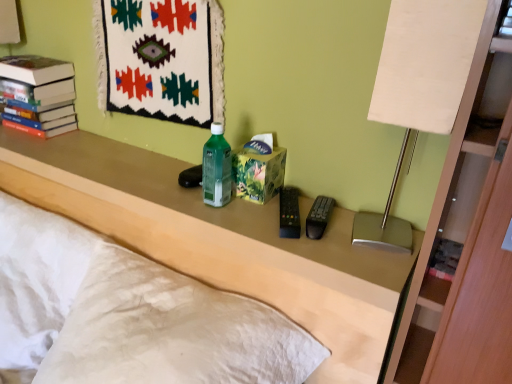
In order to click on free location in front of matte beige table lamp at right in this screenshot , I will do `click(385, 271)`.